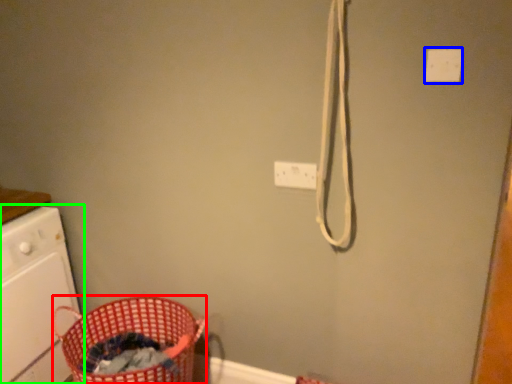
Question: Which object is the closest to the basket (highlighted by a red box)? Choose among these: light switch (highlighted by a blue box) or home appliance (highlighted by a green box).

Choices:
 (A) light switch
 (B) home appliance

Answer: (B)